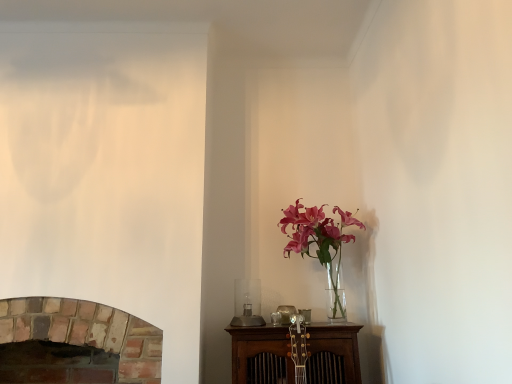
Question: Could you tell me if brick fireplace at lower left is facing translucent glass vase at upper right?

Choices:
 (A) yes
 (B) no

Answer: (B)

Question: Considering the relative positions of brick fireplace at lower left and translucent glass vase at upper right in the image provided, is brick fireplace at lower left in front of translucent glass vase at upper right?

Choices:
 (A) yes
 (B) no

Answer: (A)

Question: Is brick fireplace at lower left further to the viewer compared to translucent glass vase at upper right?

Choices:
 (A) yes
 (B) no

Answer: (B)

Question: From a real-world perspective, is brick fireplace at lower left positioned over translucent glass vase at upper right based on gravity?

Choices:
 (A) no
 (B) yes

Answer: (A)

Question: From a real-world perspective, is brick fireplace at lower left below translucent glass vase at upper right?

Choices:
 (A) yes
 (B) no

Answer: (A)

Question: Is brick fireplace at lower left at the left side of translucent glass vase at upper right?

Choices:
 (A) yes
 (B) no

Answer: (A)

Question: Considering the relative positions of translucent glass vase at upper right and brick fireplace at lower left in the image provided, is translucent glass vase at upper right to the right of brick fireplace at lower left from the viewer's perspective?

Choices:
 (A) no
 (B) yes

Answer: (B)

Question: Can you confirm if translucent glass vase at upper right is positioned to the left of brick fireplace at lower left?

Choices:
 (A) no
 (B) yes

Answer: (A)

Question: Is there a large distance between translucent glass vase at upper right and brick fireplace at lower left?

Choices:
 (A) yes
 (B) no

Answer: (B)

Question: Is translucent glass vase at upper right directly adjacent to brick fireplace at lower left?

Choices:
 (A) no
 (B) yes

Answer: (A)

Question: Is translucent glass vase at upper right completely or partially outside of brick fireplace at lower left?

Choices:
 (A) yes
 (B) no

Answer: (A)

Question: From the image's perspective, is translucent glass vase at upper right located above brick fireplace at lower left?

Choices:
 (A) yes
 (B) no

Answer: (A)

Question: Is brick fireplace at lower left inside or outside of translucent glass vase at upper right?

Choices:
 (A) outside
 (B) inside

Answer: (A)